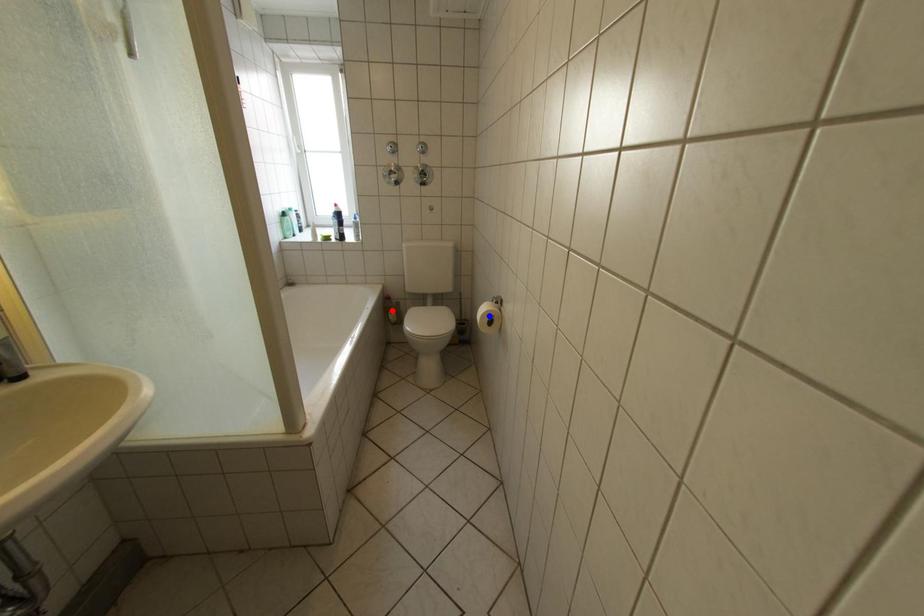
Question: Which of the two points in the image is closer to the camera?

Choices:
 (A) Blue point is closer.
 (B) Red point is closer.

Answer: (A)